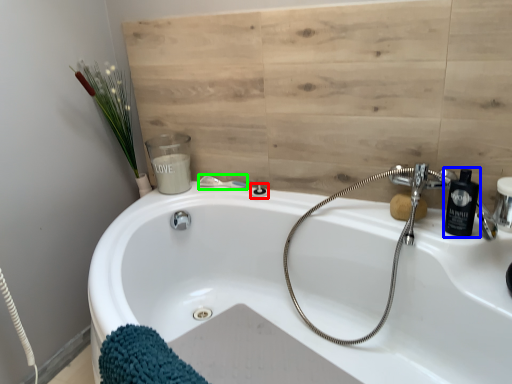
Question: Estimate the real-world distances between objects in this image. Which object is closer to shower (highlighted by a red box), soap dispenser (highlighted by a blue box) or shower (highlighted by a green box)?

Choices:
 (A) soap dispenser
 (B) shower

Answer: (B)